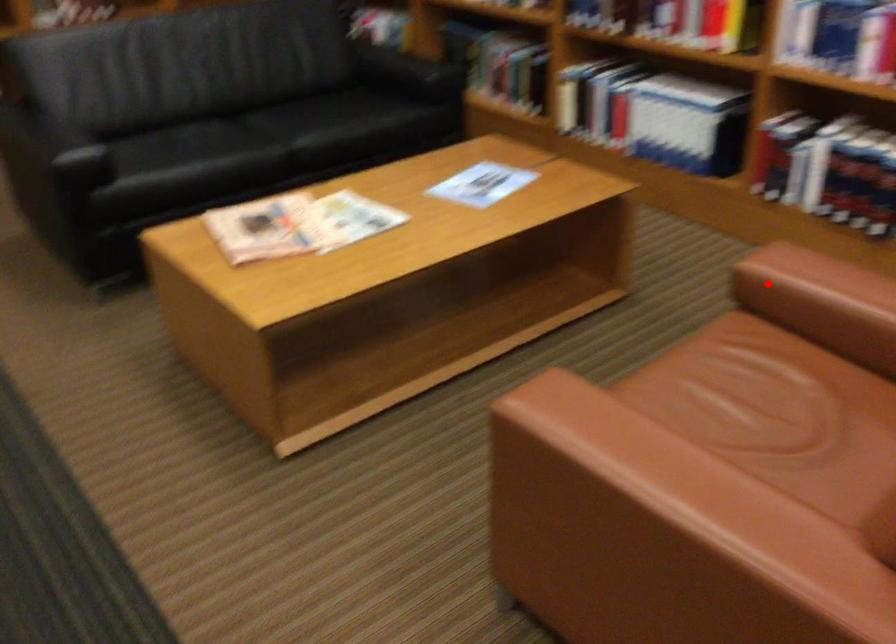
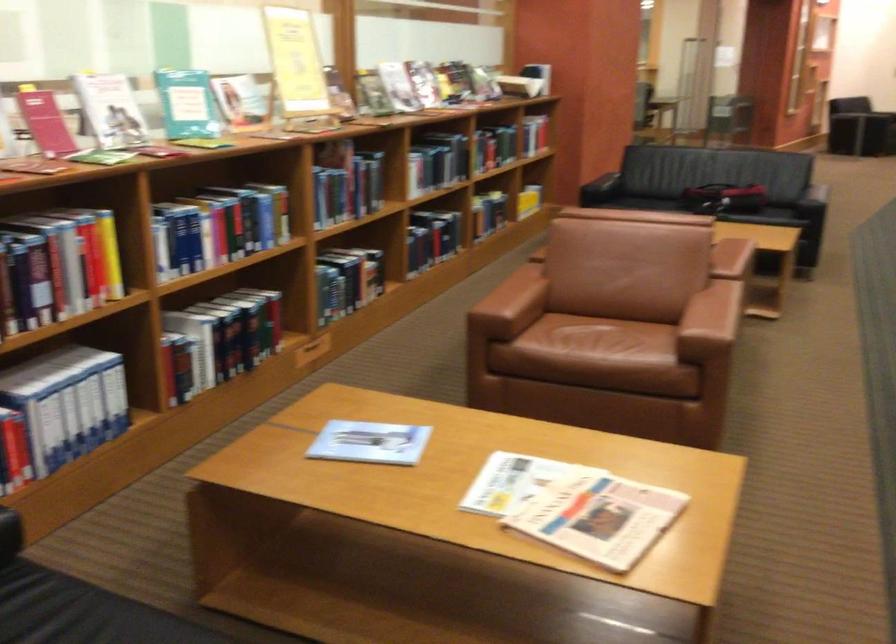
Where in the second image is the point corresponding to the highlighted location from the first image?

(510, 305)